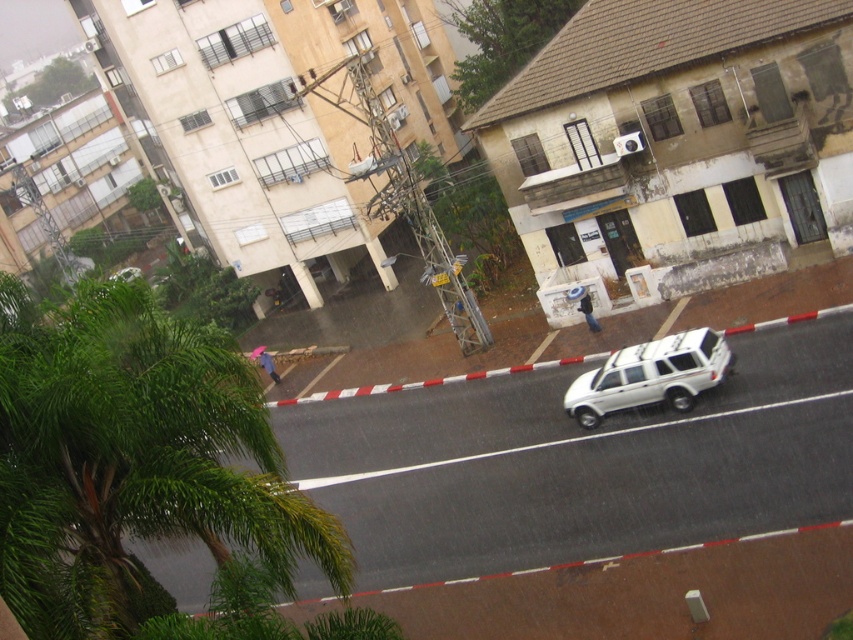
Question: Estimate the real-world distances between objects in this image. Which object is farther from the white matte suv at center?

Choices:
 (A) white matte suv at center-right
 (B) green leafy palm tree at lower left

Answer: (B)

Question: Can you confirm if white matte suv at center is positioned above white matte suv at center-right?

Choices:
 (A) yes
 (B) no

Answer: (B)

Question: Considering the relative positions of green leafy palm tree at lower left and white matte suv at center-right in the image provided, where is green leafy palm tree at lower left located with respect to white matte suv at center-right?

Choices:
 (A) above
 (B) below

Answer: (B)

Question: Considering the real-world distances, which object is closest to the white matte suv at center?

Choices:
 (A) green leafy palm tree at lower left
 (B) white matte suv at center-right

Answer: (B)

Question: Is white matte suv at center smaller than white matte suv at center-right?

Choices:
 (A) no
 (B) yes

Answer: (A)

Question: Which of the following is the farthest from the observer?

Choices:
 (A) green leafy palm tree at lower left
 (B) white matte suv at center
 (C) white matte suv at center-right

Answer: (C)